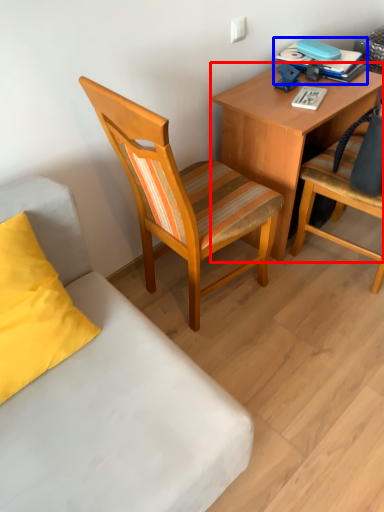
Question: Which object is further to the camera taking this photo, desk (highlighted by a red box) or book (highlighted by a blue box)?

Choices:
 (A) desk
 (B) book

Answer: (B)